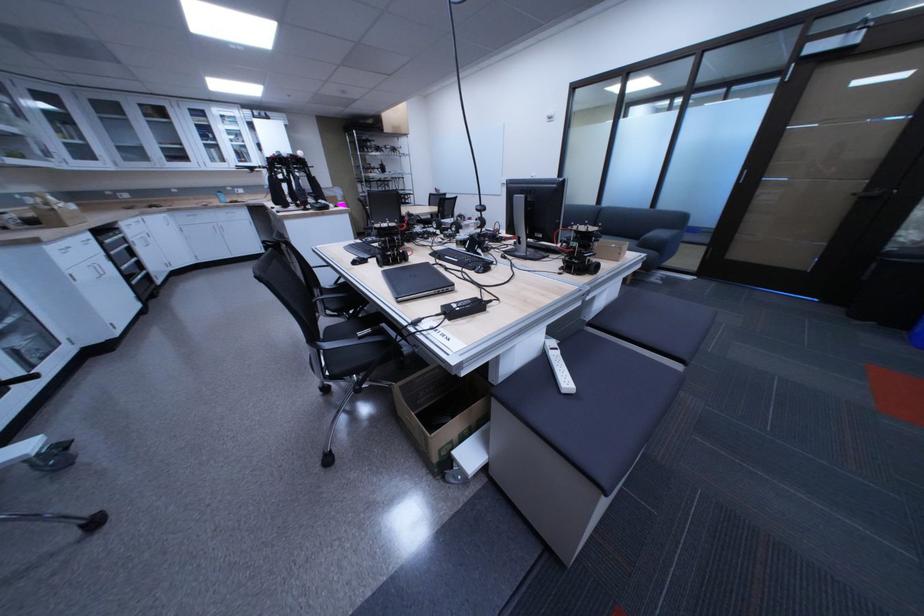
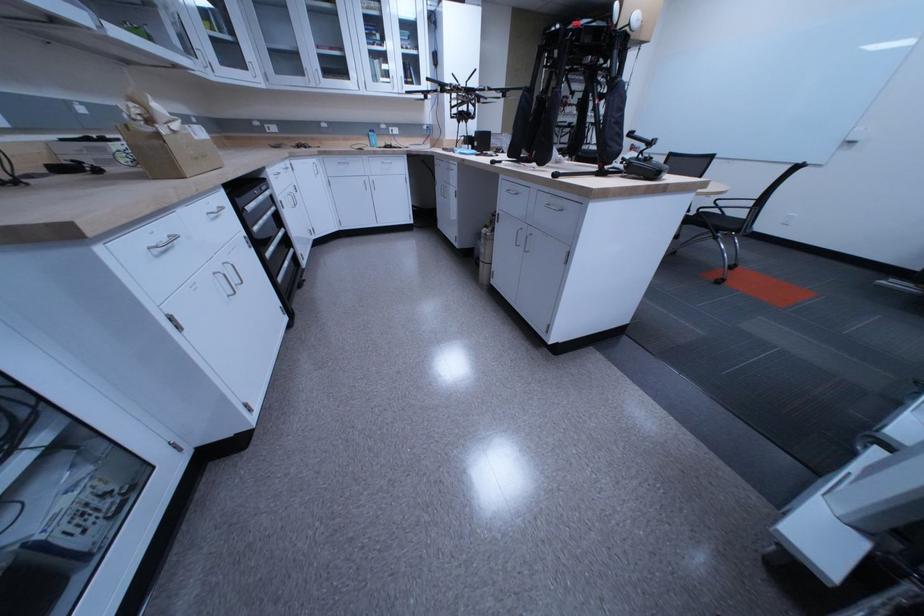
Where in the second image is the point corresponding to point (66, 163) from the first image?

(205, 61)